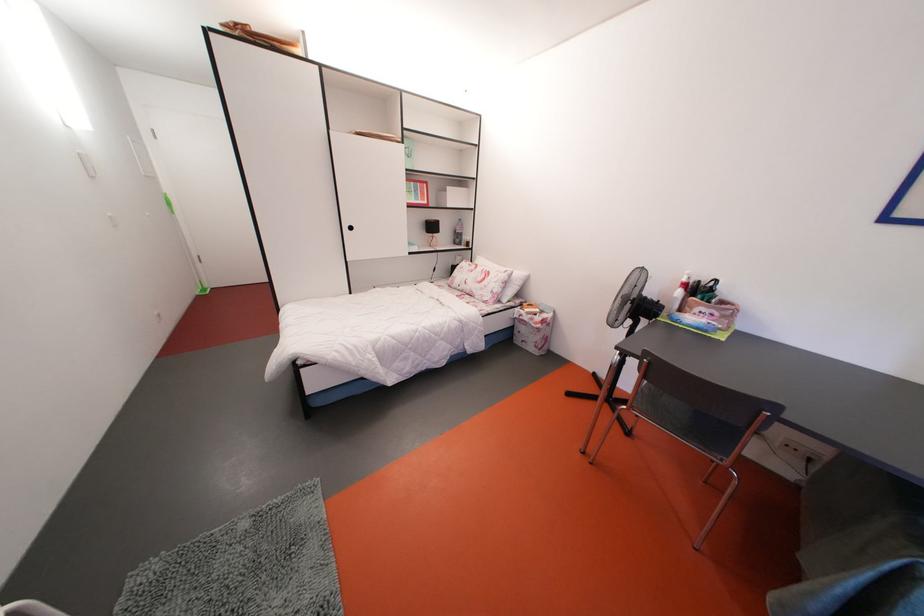
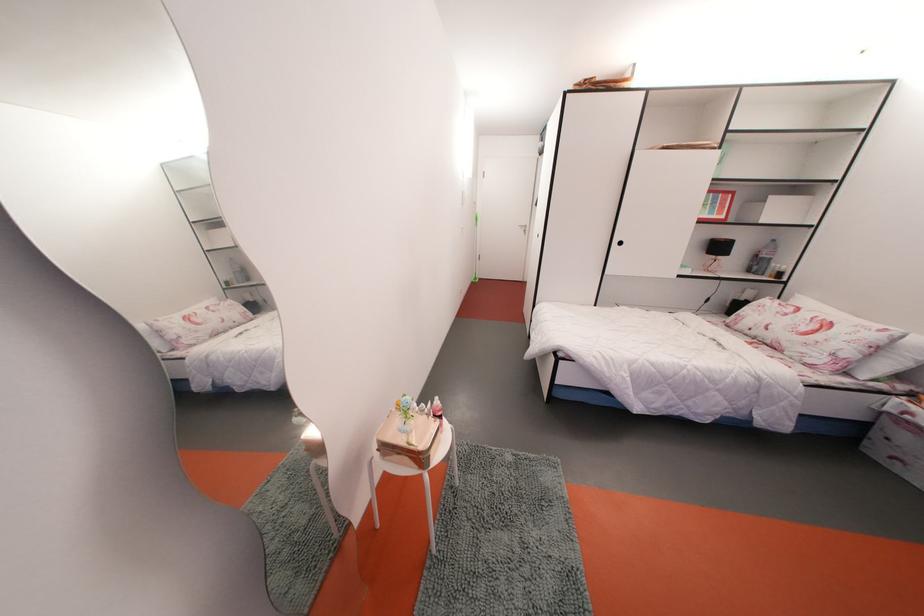
Where in the second image is the point corresponding to point 465,241 from the first image?

(764, 268)